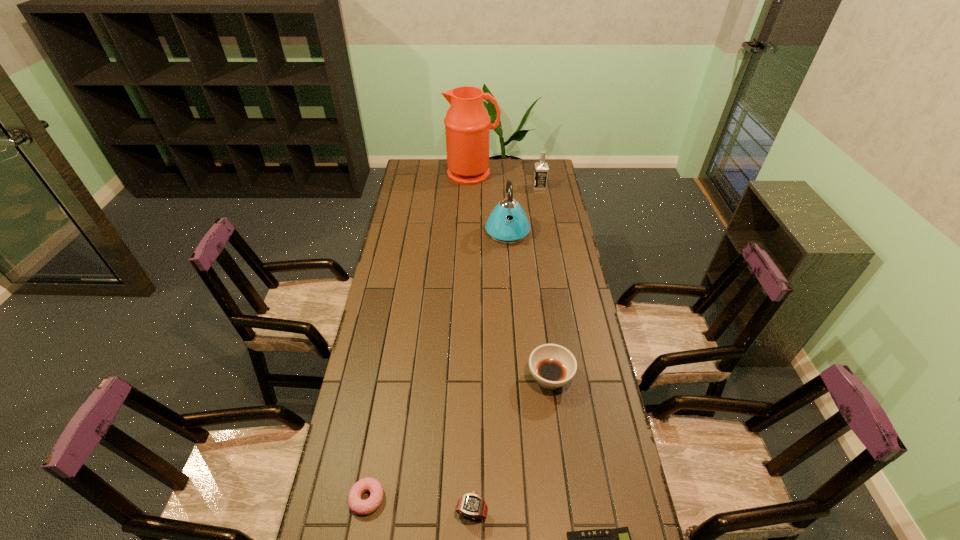
What are the coordinates of `vacant region located 0.150m at the spout of the second tallest object` in the screenshot? It's located at (511, 270).

At what (x,y) coordinates should I click in order to perform the action: click on free space located 0.080m on the front label of the vodka. Please return your answer as a coordinate pair (x, y). The image size is (960, 540). Looking at the image, I should click on (517, 187).

Locate an element on the screen. free space located on the front label of the vodka is located at coordinates (500, 187).

I want to click on free space located on the front label of the vodka, so click(480, 187).

Image resolution: width=960 pixels, height=540 pixels. Identify the location of vacant area situated on the front of the fourth shortest object. (565, 492).

I want to click on vacant space located 0.120m on the back of the watch, so click(x=472, y=455).

Where is `free space located 0.060m on the back of the leftmost object`? free space located 0.060m on the back of the leftmost object is located at coordinates (373, 460).

Where is `object positioned at the far edge`? object positioned at the far edge is located at coordinates (467, 124).

Where is `object that is at the left edge`? The image size is (960, 540). object that is at the left edge is located at coordinates (362, 507).

In order to click on vodka positioned at the right edge in this screenshot , I will do `click(541, 168)`.